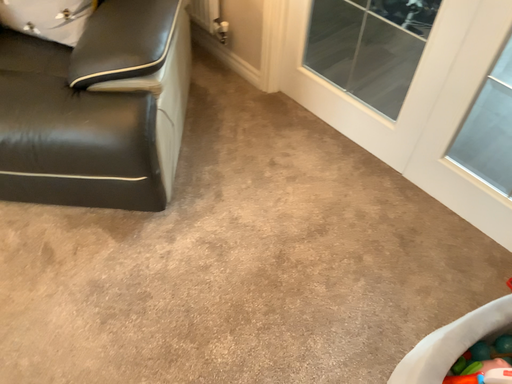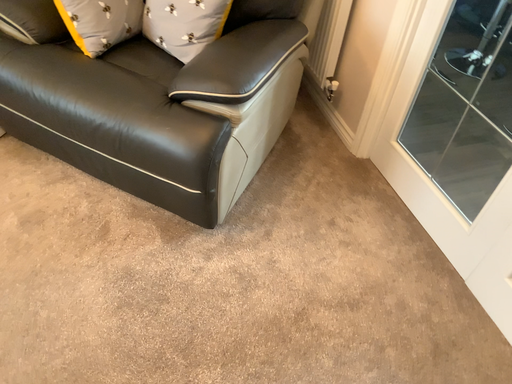
Question: Which way did the camera rotate in the video?

Choices:
 (A) rotated left
 (B) rotated right

Answer: (A)